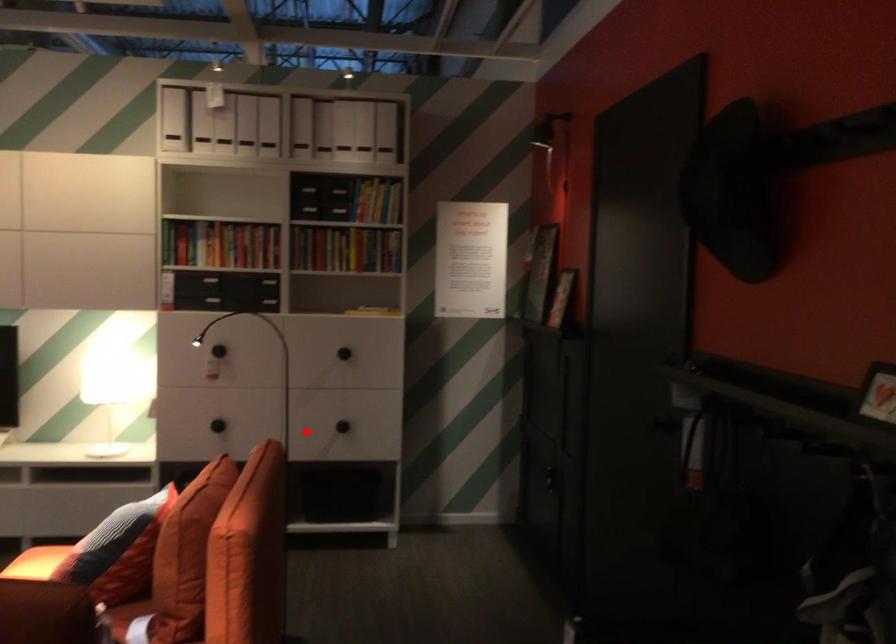
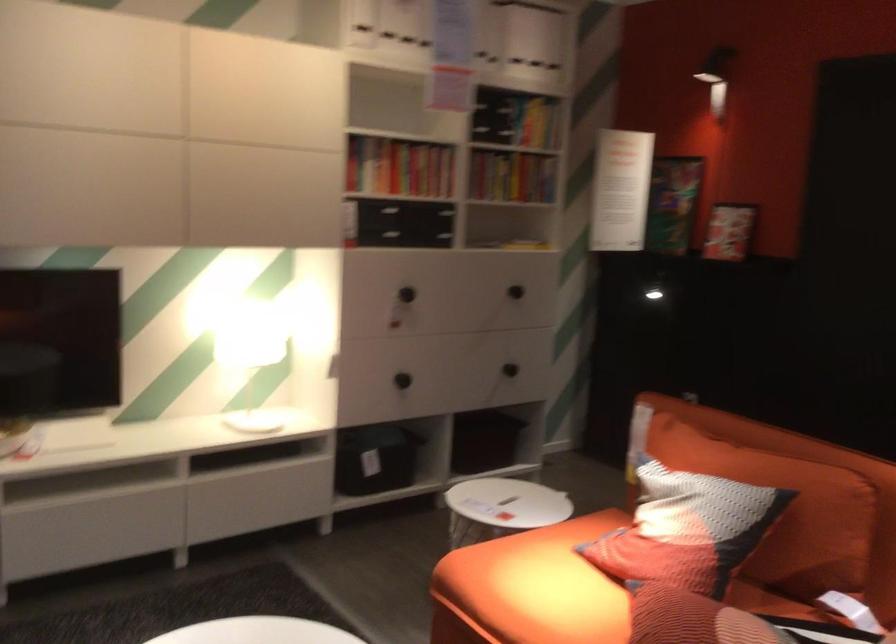
Question: I am providing you with two images of the same scene from different viewpoints. Given a red point in image1, look at the same physical point in image2. Is it:

Choices:
 (A) Closer to the viewpoint
 (B) Farther from the viewpoint

Answer: (A)